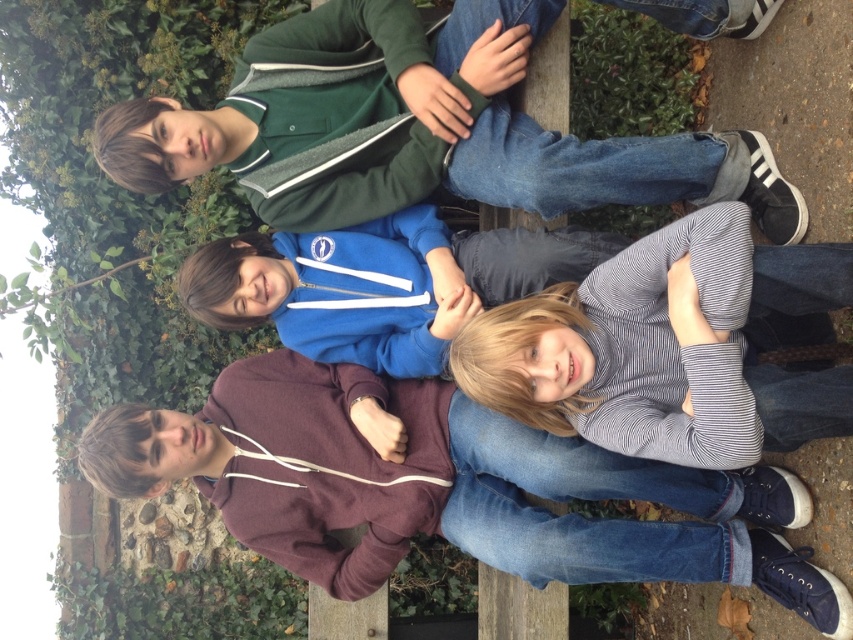
You are standing in front of the bench where the four people are sitting. You want to hand a brochure to the person wearing the green fleece jacket at upper center and the blue fleece jacket at center. Which jacket is closer to you so you can reach it first?

The green fleece jacket at upper center is closer to the viewer than the blue fleece jacket at center, so you can reach it first.

You are standing in a park and see two people sitting on a bench. One is wearing a green fleece jacket at upper center and the other has a striped cotton shirt at lower right. Which person is sitting to the left of the other?

The green fleece jacket at upper center is to the left of the striped cotton shirt at lower right.

You are standing at the point labeled as point (457, 54) in the image. A friend is standing 25 feet away from you. Can they see you from their position?

The distance between you and the viewer at point (457, 54) is 23.43 feet. Since your friend is 25 feet away, they are slightly farther than the point, so they might not be able to see you clearly depending on the line of sight and any obstructions.